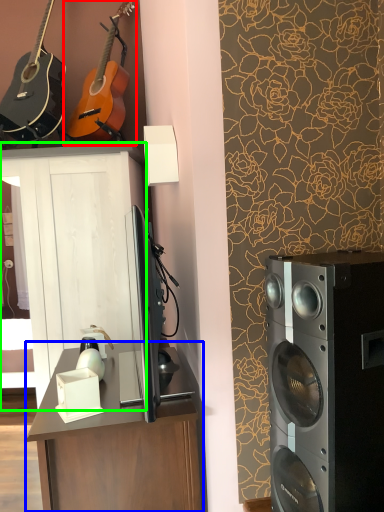
Question: Which object is the farthest from guitar (highlighted by a red box)? Choose among these: desk (highlighted by a blue box) or cabinetry (highlighted by a green box).

Choices:
 (A) desk
 (B) cabinetry

Answer: (A)